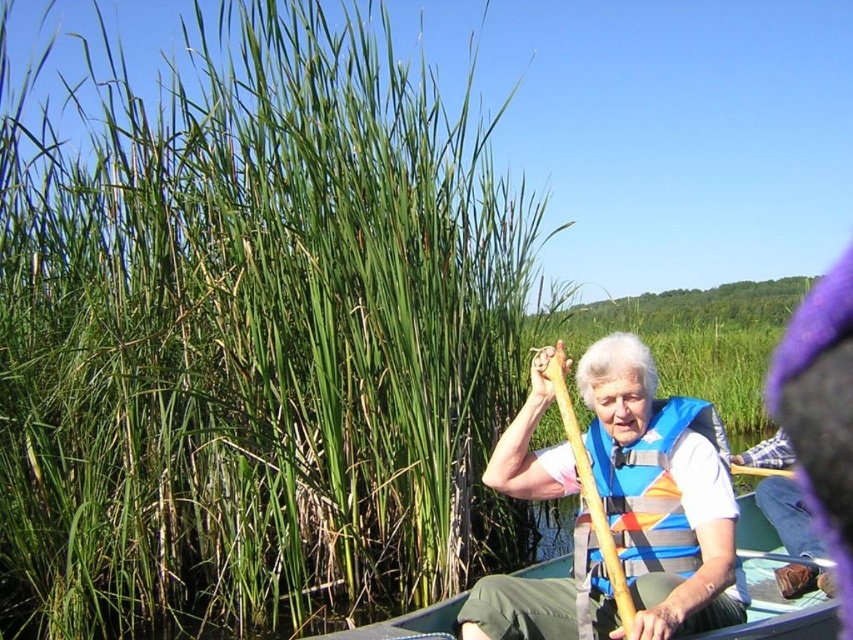
Is blue life vest at center shorter than green plastic canoe at center?

Incorrect, blue life vest at center's height does not fall short of green plastic canoe at center's.

Who is positioned more to the right, blue life vest at center or green plastic canoe at center?

Positioned to the right is green plastic canoe at center.

What do you see at coordinates (660, 493) in the screenshot? The height and width of the screenshot is (640, 853). I see `blue life vest at center` at bounding box center [660, 493].

Image resolution: width=853 pixels, height=640 pixels. I want to click on blue life vest at center, so click(660, 493).

Does green plastic canoe at center have a larger size compared to wooden paddle at center?

Incorrect, green plastic canoe at center is not larger than wooden paddle at center.

Between green plastic canoe at center and wooden paddle at center, which one has more height?

wooden paddle at center is taller.

Does point (550, 570) lie behind point (621, 577)?

Yes, point (550, 570) is farther from viewer.

Where is `green plastic canoe at center`? The width and height of the screenshot is (853, 640). green plastic canoe at center is located at coordinates (778, 609).

Between green grass at upper left and green plastic canoe at center, which one has less height?

green plastic canoe at center is shorter.

Who is lower down, green grass at upper left or green plastic canoe at center?

Positioned lower is green plastic canoe at center.

Does point (221, 74) lie in front of point (442, 604)?

That is False.

The height and width of the screenshot is (640, 853). Find the location of `green grass at upper left`. green grass at upper left is located at coordinates (254, 337).